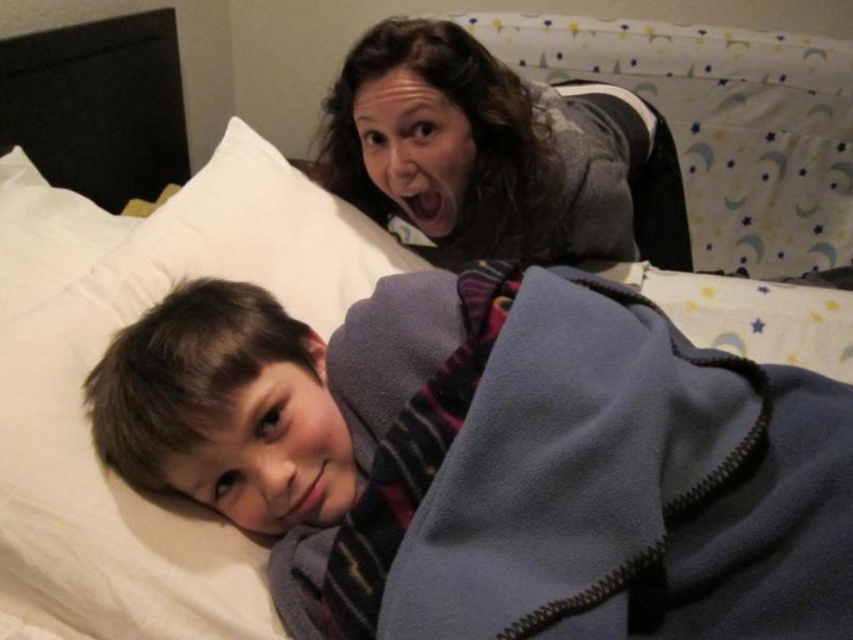
Is point (695, 518) positioned behind point (184, 577)?

No, it is not.

This screenshot has height=640, width=853. What do you see at coordinates (572, 476) in the screenshot?
I see `fleece at lower left` at bounding box center [572, 476].

In order to click on fleece at lower left in this screenshot , I will do `click(572, 476)`.

Does point (38, 465) come behind point (355, 88)?

No, (38, 465) is closer to viewer.

Can you confirm if white soft pillow at upper center is positioned above gray fleece at upper center?

Actually, white soft pillow at upper center is below gray fleece at upper center.

Between point (234, 595) and point (402, 156), which one is positioned in front?

Point (234, 595)

This screenshot has width=853, height=640. I want to click on white soft pillow at upper center, so click(x=86, y=420).

Does fleece at lower left lie in front of gray fleece at upper center?

Yes, fleece at lower left is in front of gray fleece at upper center.

How distant is fleece at lower left from gray fleece at upper center?

fleece at lower left is 20.00 inches away from gray fleece at upper center.

Does point (380, 413) come closer to viewer compared to point (392, 86)?

Yes, it is in front of point (392, 86).

Where is `fleece at lower left`? This screenshot has height=640, width=853. fleece at lower left is located at coordinates (572, 476).